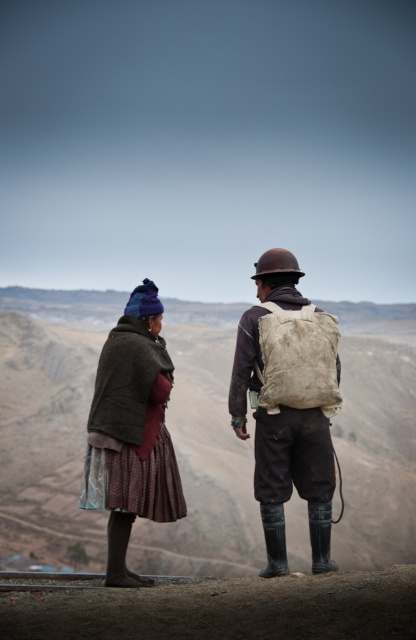
You are standing at the viewpoint where the two people are located. There are two points marked in the image. One is at coordinates point (272, 266) and the other is at point (148, 417). Which point is closer to you?

Point (148, 417) is closer to you because point (272, 266) is behind it.

You are a hiker who needs to retrieve your matte brown backpack at center. However, there is a dark brown woolen coat at left in the way. Can you reach your backpack without moving the coat?

The matte brown backpack at center is in front of the dark brown woolen coat at left, so you can reach it without moving the coat.